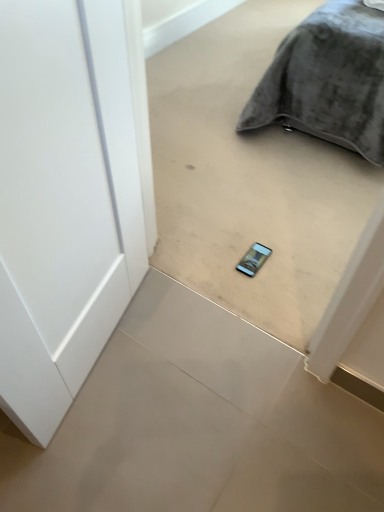
Question: From the image's perspective, is white glossy concrete at center, placed as the first concrete when sorted from bottom to top, located above matte gray phone at center, which is counted as the first concrete, starting from the top?

Choices:
 (A) no
 (B) yes

Answer: (A)

Question: Considering the relative sizes of white glossy concrete at center, placed as the first concrete when sorted from bottom to top, and matte gray phone at center, acting as the second concrete starting from the bottom, in the image provided, is white glossy concrete at center, placed as the first concrete when sorted from bottom to top, taller than matte gray phone at center, acting as the second concrete starting from the bottom,?

Choices:
 (A) no
 (B) yes

Answer: (A)

Question: Is white glossy concrete at center, placed as the first concrete when sorted from bottom to top, facing away from matte gray phone at center, acting as the second concrete starting from the bottom?

Choices:
 (A) no
 (B) yes

Answer: (A)

Question: Can you confirm if white glossy concrete at center, the second concrete positioned from the top, is thinner than matte gray phone at center, acting as the second concrete starting from the bottom?

Choices:
 (A) no
 (B) yes

Answer: (A)

Question: Is white glossy concrete at center, the second concrete positioned from the top, bigger than matte gray phone at center, which is counted as the first concrete, starting from the top?

Choices:
 (A) yes
 (B) no

Answer: (B)

Question: From the image's perspective, is white glossy concrete at center, the second concrete positioned from the top, located above or below matte gray phone at center, acting as the second concrete starting from the bottom?

Choices:
 (A) above
 (B) below

Answer: (B)

Question: Is white glossy concrete at center, the second concrete positioned from the top, taller or shorter than matte gray phone at center, acting as the second concrete starting from the bottom?

Choices:
 (A) tall
 (B) short

Answer: (B)

Question: Is white glossy concrete at center, placed as the first concrete when sorted from bottom to top, inside the boundaries of matte gray phone at center, acting as the second concrete starting from the bottom, or outside?

Choices:
 (A) inside
 (B) outside

Answer: (B)

Question: Is point (64, 433) positioned closer to the camera than point (319, 214)?

Choices:
 (A) farther
 (B) closer

Answer: (B)

Question: From a real-world perspective, is velvet gray pillow at upper right above or below matte gray phone at center, acting as the second concrete starting from the bottom?

Choices:
 (A) above
 (B) below

Answer: (B)

Question: Considering the positions of velvet gray pillow at upper right and matte gray phone at center, which is counted as the first concrete, starting from the top, in the image, is velvet gray pillow at upper right taller or shorter than matte gray phone at center, which is counted as the first concrete, starting from the top,?

Choices:
 (A) tall
 (B) short

Answer: (B)

Question: In terms of width, does velvet gray pillow at upper right look wider or thinner when compared to matte gray phone at center, which is counted as the first concrete, starting from the top?

Choices:
 (A) thin
 (B) wide

Answer: (B)

Question: Considering their positions, is velvet gray pillow at upper right located in front of or behind matte gray phone at center, acting as the second concrete starting from the bottom?

Choices:
 (A) behind
 (B) front

Answer: (A)

Question: Would you say matte gray phone at center, which is counted as the first concrete, starting from the top, is to the left or to the right of white glossy concrete at center, placed as the first concrete when sorted from bottom to top, in the picture?

Choices:
 (A) right
 (B) left

Answer: (A)

Question: Is matte gray phone at center, acting as the second concrete starting from the bottom, spatially inside white glossy concrete at center, placed as the first concrete when sorted from bottom to top, or outside of it?

Choices:
 (A) outside
 (B) inside

Answer: (A)